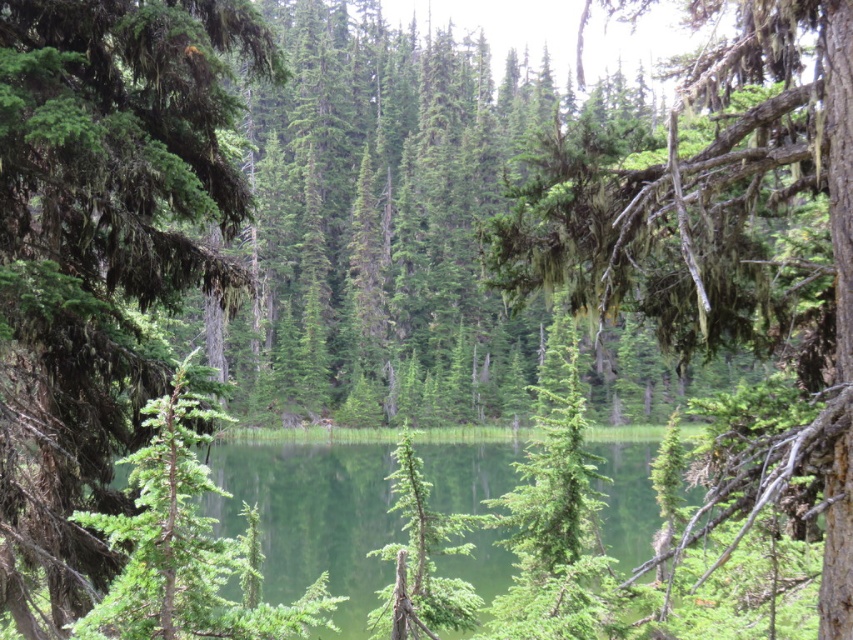
Question: Which point appears closest to the camera in this image?

Choices:
 (A) (659, 232)
 (B) (51, 118)

Answer: (A)

Question: Can you confirm if green matte tree at center is positioned below green lichen-covered branch at upper right?

Choices:
 (A) yes
 (B) no

Answer: (A)

Question: Which of these objects is positioned closest to the green reflective water at center?

Choices:
 (A) green lichen-covered branch at upper right
 (B) green matte tree at center

Answer: (A)

Question: Does green matte tree at center have a lesser width compared to green lichen-covered branch at upper right?

Choices:
 (A) no
 (B) yes

Answer: (B)

Question: Is green matte tree at center positioned behind green lichen-covered branch at upper right?

Choices:
 (A) no
 (B) yes

Answer: (B)

Question: Which is nearer to the green lichen-covered branch at upper right?

Choices:
 (A) green reflective water at center
 (B) green matte tree at center

Answer: (B)